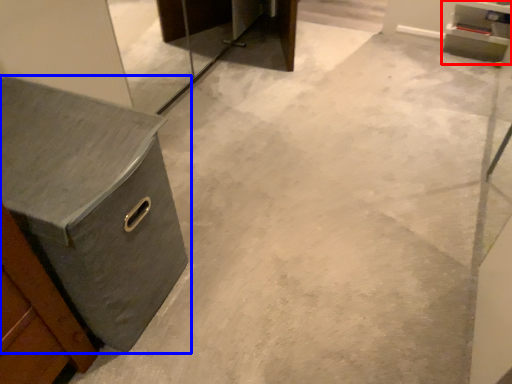
Question: Which object appears farthest to the camera in this image, cabinetry (highlighted by a red box) or chest of drawers (highlighted by a blue box)?

Choices:
 (A) cabinetry
 (B) chest of drawers

Answer: (A)